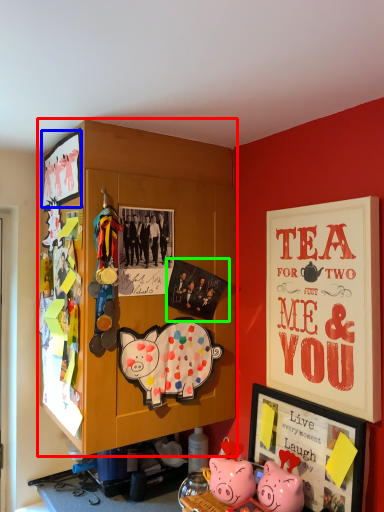
Question: Which object is the closest to the cabinetry (highlighted by a red box)? Choose among these: picture frame (highlighted by a blue box) or poster page (highlighted by a green box).

Choices:
 (A) picture frame
 (B) poster page

Answer: (B)